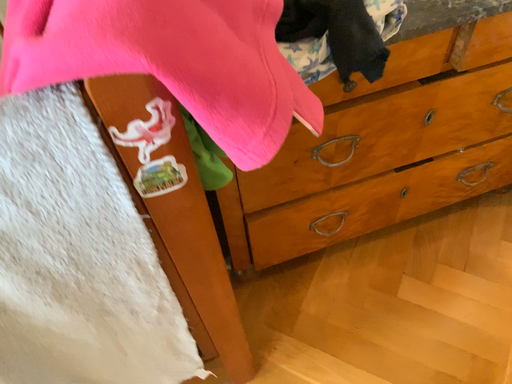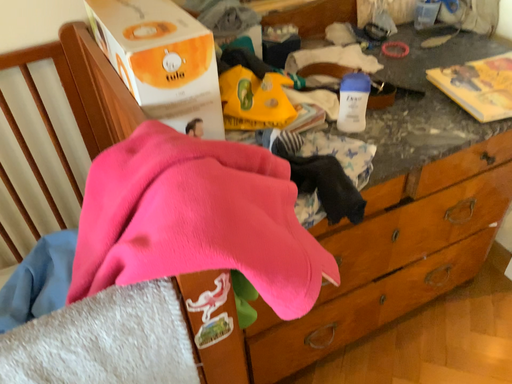
Question: Which way did the camera rotate in the video?

Choices:
 (A) rotated upward
 (B) rotated downward

Answer: (A)